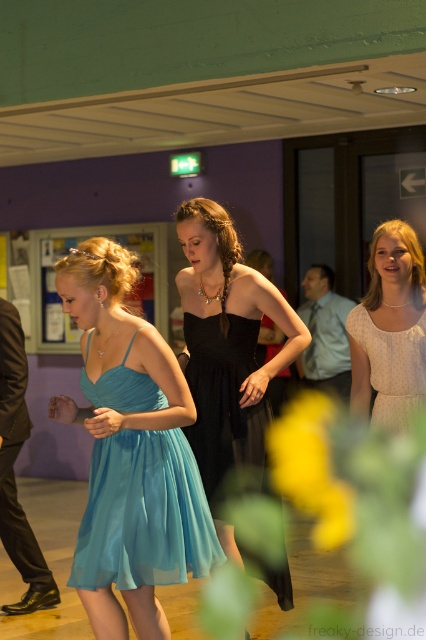
Can you confirm if black satin dress at center is wider than light beige textured dress at right?

Indeed, black satin dress at center has a greater width compared to light beige textured dress at right.

Between black satin dress at center and light beige textured dress at right, which one has more height?

Standing taller between the two is black satin dress at center.

Is point (201, 404) less distant than point (405, 394)?

No, it is behind (405, 394).

At what (x,y) coordinates should I click in order to perform the action: click on black satin dress at center. Please return your answer as a coordinate pair (x, y). This screenshot has width=426, height=640. Looking at the image, I should click on (227, 349).

Does black satin dress at center appear over light blue chiffon dress at center?

Yes.

Which is in front, point (201, 458) or point (196, 528)?

Point (196, 528) is in front.

Identify the location of black satin dress at center. (227, 349).

Who is shorter, black satin dress at center or light beige textured dress at center?

light beige textured dress at center is shorter.

The height and width of the screenshot is (640, 426). Describe the element at coordinates (227, 349) in the screenshot. I see `black satin dress at center` at that location.

Does point (270, 358) lie in front of point (351, 356)?

No, (270, 358) is behind (351, 356).

Locate an element on the screen. The width and height of the screenshot is (426, 640). black satin dress at center is located at coordinates (227, 349).